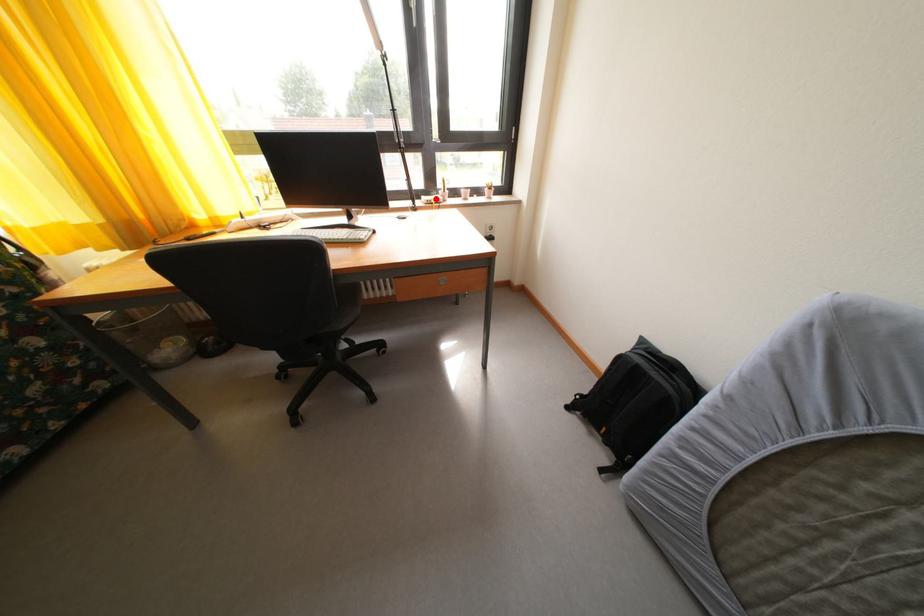
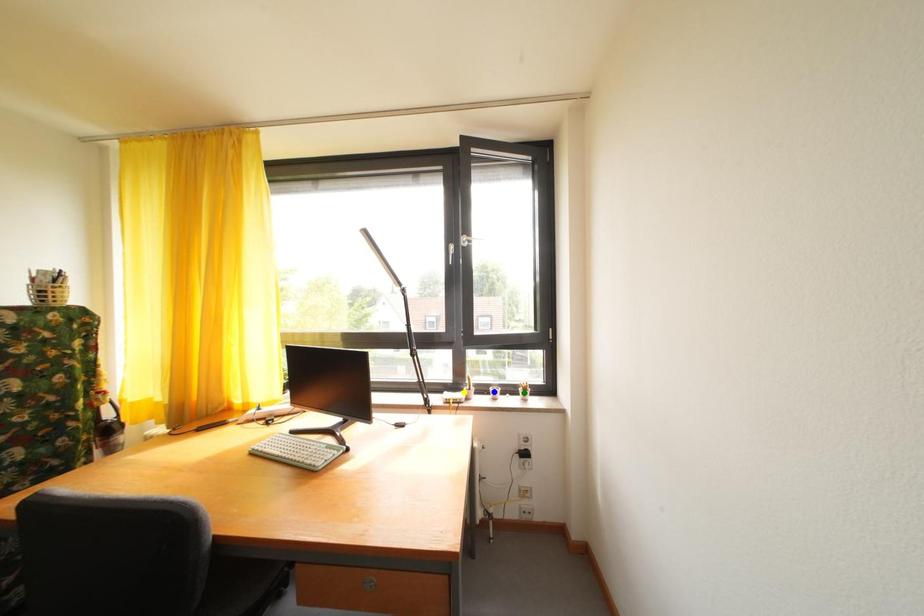
Question: I am providing you with two images of the same scene from different viewpoints. A red point is marked on the first image. You are given multiple points on the second image. In image 2, which mark is for the same physical point as the one in image 1?

Choices:
 (A) blue point
 (B) green point
 (C) yellow point

Answer: (C)